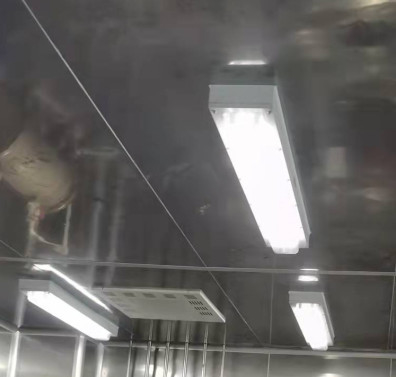
At what (x,y) coordinates should I click in order to perform the action: click on ceiling light. Please return your answer as a coordinate pair (x, y). Looking at the image, I should click on (76, 324), (303, 316), (305, 278), (309, 267), (75, 284), (242, 150), (242, 62).